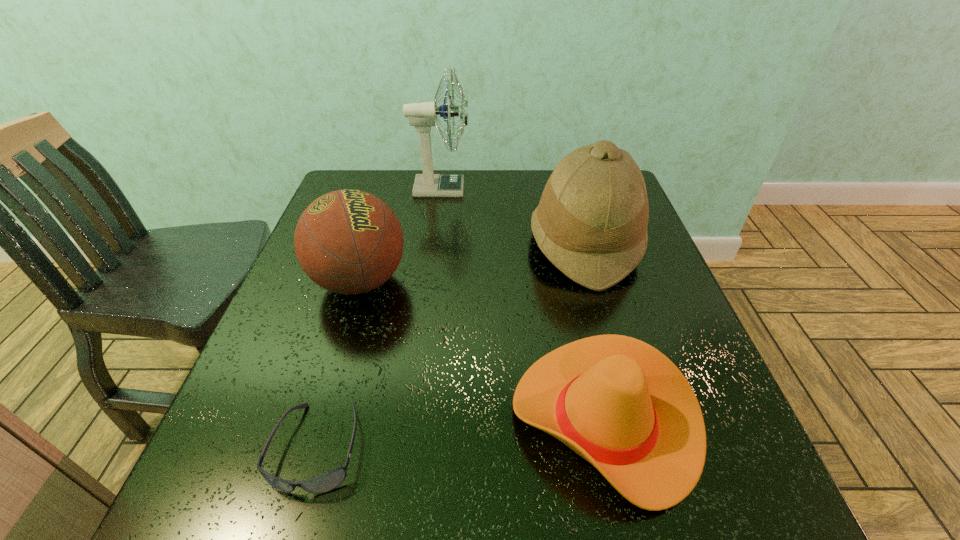
Where is `free region that satisfies the following two spatial constraints: 1. on the front-facing side of the tallest object; 2. on the front side of the basketball`? The width and height of the screenshot is (960, 540). free region that satisfies the following two spatial constraints: 1. on the front-facing side of the tallest object; 2. on the front side of the basketball is located at coordinates (429, 281).

Identify the location of vacant region that satisfies the following two spatial constraints: 1. on the front side of the third tallest object; 2. on the left side of the fourth tallest object. This screenshot has height=540, width=960. (319, 419).